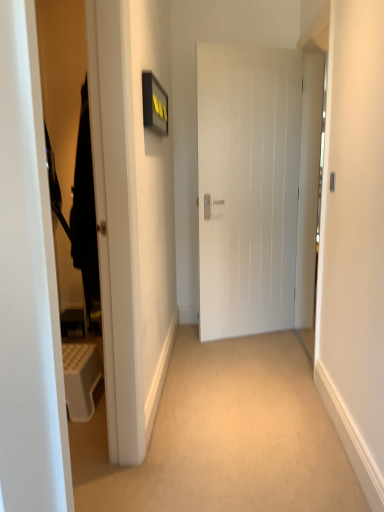
Question: Is white matte door at center in front of or behind satin silver door handle at center in the image?

Choices:
 (A) behind
 (B) front

Answer: (A)

Question: Based on their sizes in the image, would you say white matte door at center is bigger or smaller than satin silver door handle at center?

Choices:
 (A) big
 (B) small

Answer: (A)

Question: Estimate the real-world distances between objects in this image. Which object is farther from the black fabric robe at left?

Choices:
 (A) white matte door at center
 (B) satin silver door handle at center

Answer: (A)

Question: Which of these objects is positioned closest to the black fabric robe at left?

Choices:
 (A) white matte door at center
 (B) satin silver door handle at center

Answer: (B)